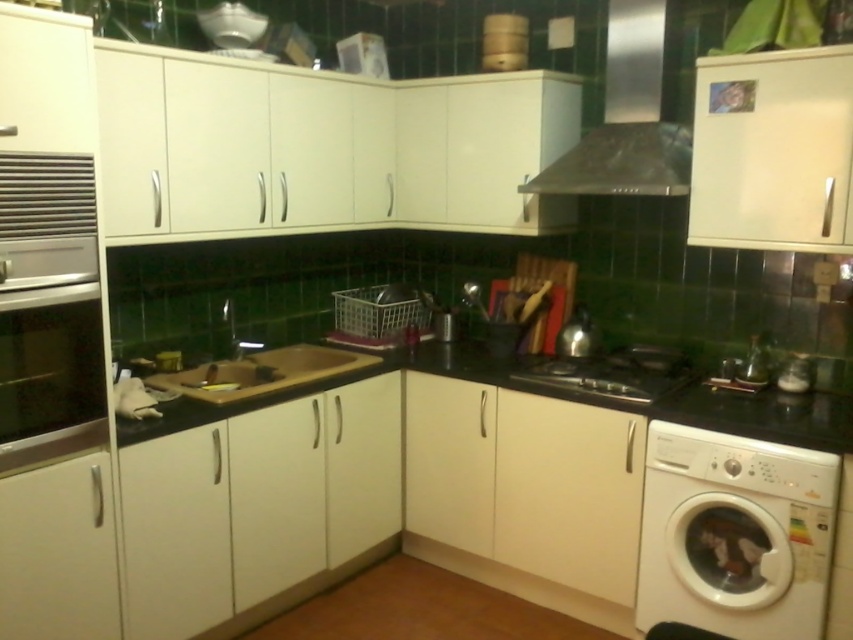
Looking at this image, you are moving into a new apartment and need to place your white plastic washing machine at lower right and black matte countertop at center. Given their sizes, which object should you prioritize placing first to ensure proper fitting in the kitchen?

The white plastic washing machine at lower right has a smaller size compared to the black matte countertop at center. Since it is smaller, you should prioritize placing the white plastic washing machine at lower right first to ensure it fits appropriately around the larger countertop.

Consider the image. You are standing in the kitchen and want to place a small decorative item on the black matte countertop at center. The point you are aiming for is marked as point [572,400]. Is this point located on the black matte countertop at center?

Yes, the point [572,400] is located on the black matte countertop at center.